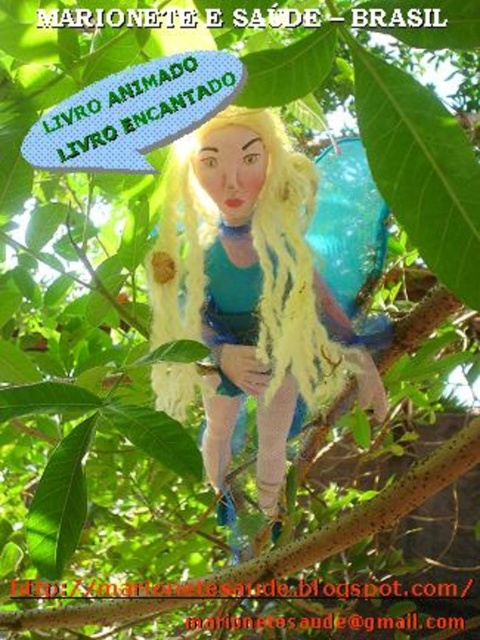
Consider the image. You are a character in a storybook and you see the fuzzy fabric doll at center and the brown rough tree branch at center. Which object is positioned more to the right side of the scene?

The fuzzy fabric doll at center is positioned more to the right side of the scene than the brown rough tree branch at center.

You are designing a new puppet show stage and need to ensure the fuzzy fabric doll at center can be securely attached to the brown rough tree branch at center. Based on their sizes, will the doll fit snugly on the branch without slipping off?

The fuzzy fabric doll at center is thinner than the brown rough tree branch at center, so the doll will fit snugly on the branch without slipping off because its smaller width allows it to grip the branch properly.